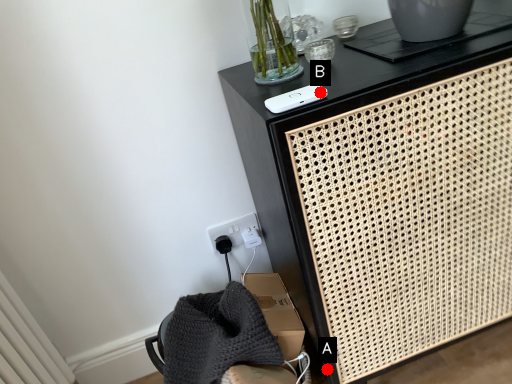
Question: Two points are circled on the image, labeled by A and B beside each circle. Which point is farther from the camera taking this photo?

Choices:
 (A) A is further
 (B) B is further

Answer: (A)